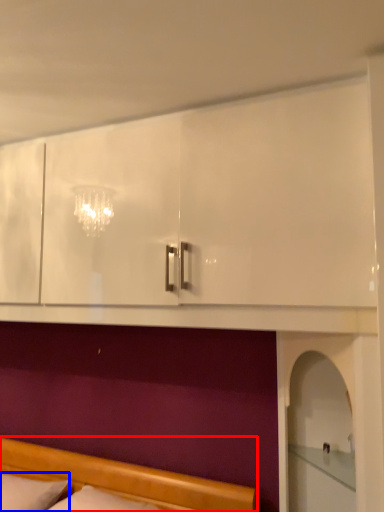
Question: Which point is closer to the camera, bed (highlighted by a red box) or pillow (highlighted by a blue box)?

Choices:
 (A) bed
 (B) pillow

Answer: (A)